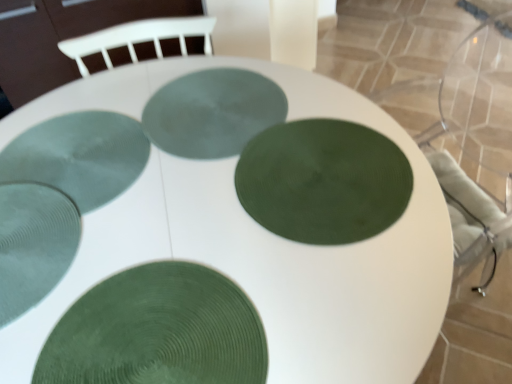
Where is `free point to the right of green textured plate at center, which appears as the first glass plate when viewed from the front`? This screenshot has width=512, height=384. free point to the right of green textured plate at center, which appears as the first glass plate when viewed from the front is located at coordinates (339, 282).